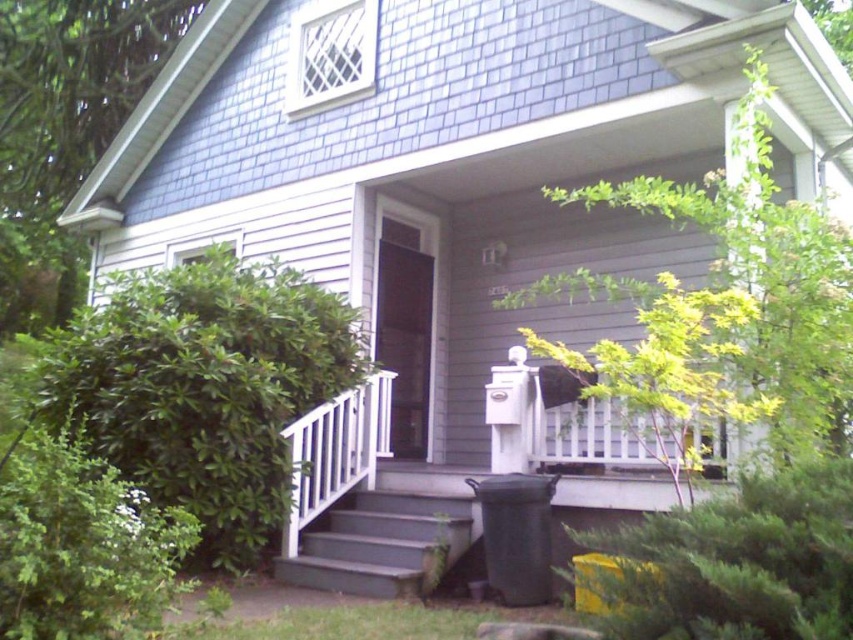
Question: Does green leafy bush at lower right appear on the left side of smooth gray stairs at lower center?

Choices:
 (A) yes
 (B) no

Answer: (B)

Question: Which point is closer to the camera?

Choices:
 (A) (755, 632)
 (B) (306, 433)

Answer: (A)

Question: Which point appears closest to the camera in this image?

Choices:
 (A) (103, 577)
 (B) (410, 525)
 (C) (380, 381)
 (D) (660, 310)

Answer: (A)

Question: Can you confirm if green leafy bush at lower left is bigger than white plastic rail at lower center?

Choices:
 (A) yes
 (B) no

Answer: (A)

Question: Is green leafy bush at lower right bigger than smooth gray stairs at lower center?

Choices:
 (A) yes
 (B) no

Answer: (A)

Question: Which of the following is the closest to the observer?

Choices:
 (A) green leafy bush at lower left
 (B) green leafy bush at left

Answer: (A)